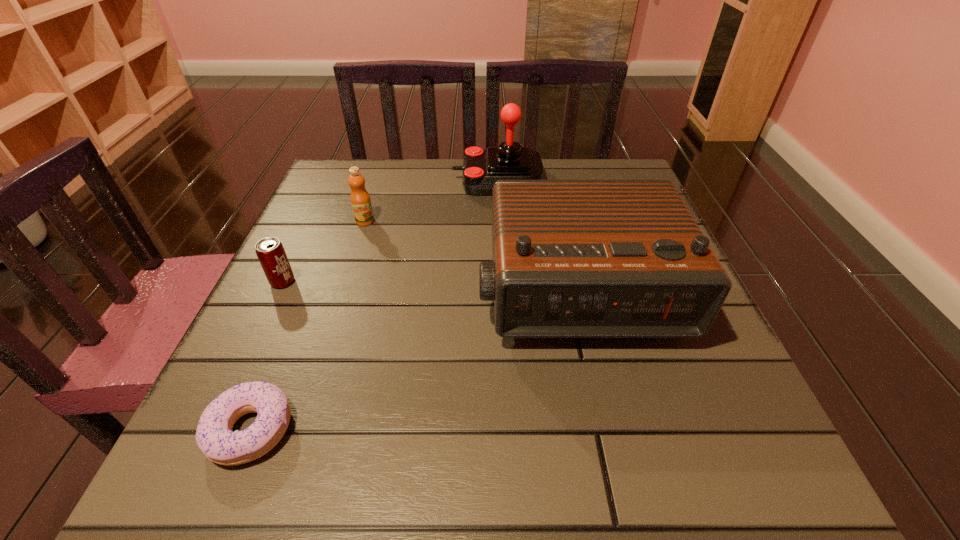
Where is `object at the near left corner`? object at the near left corner is located at coordinates (214, 436).

Identify the location of blank space at the far edge of the desktop. 425,195.

This screenshot has height=540, width=960. Find the location of `vacant region at the near edge of the desktop`. vacant region at the near edge of the desktop is located at coordinates (545, 457).

Identify the location of vacant space at the left edge of the desktop. (290, 374).

At what (x,y) coordinates should I click in order to perform the action: click on blank area at the right edge. Please return your answer as a coordinate pair (x, y). Looking at the image, I should click on (698, 352).

You are a GUI agent. You are given a task and a screenshot of the screen. Output one action in this format:
    pyautogui.click(x=<x>, y=<y>)
    Task: Click on the vacant space at the far left corner
    This screenshot has width=960, height=540.
    Given the screenshot: What is the action you would take?
    pyautogui.click(x=324, y=173)

The height and width of the screenshot is (540, 960). Find the location of `vacant space at the near left corner of the desktop`. vacant space at the near left corner of the desktop is located at coordinates (301, 444).

Image resolution: width=960 pixels, height=540 pixels. In the image, there is a desktop. In order to click on vacant area at the near right corner in this screenshot , I will do `click(658, 448)`.

You are a GUI agent. You are given a task and a screenshot of the screen. Output one action in this format:
    pyautogui.click(x=<x>, y=<y>)
    Task: Click on the blank region between the nearest object and the farthest object
    This screenshot has width=960, height=540.
    Given the screenshot: What is the action you would take?
    pyautogui.click(x=374, y=305)

I want to click on unoccupied position between the radio receiver and the doughnut, so click(414, 361).